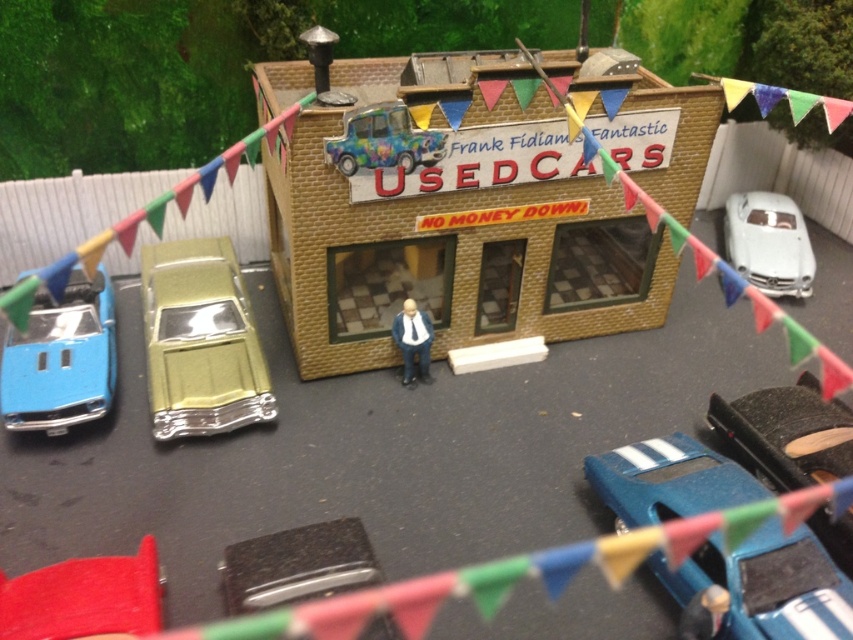
You are a customer looking to buy a car from Frank Fidiam. The dealership requires you to approach the building from the metallic gold car at left. What direction should you walk to reach the building?

Since the metallic gold car at left is located at point (200, 340), you should walk towards the right to reach the building.

You are a delivery person trying to park a 3.5 meter long truck between the matte blue car at left and the white glossy car at right. Can you fit the truck in the space between them?

The matte blue car at left and the white glossy car at right are 3.51 meters apart, so yes, the truck can fit since its length is slightly shorter than the available space.